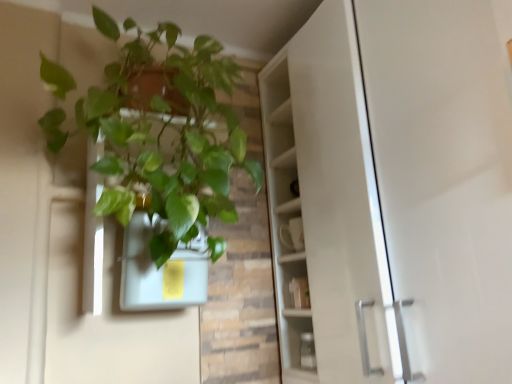
Question: Is matte white flowerpot at upper left surrounded by green matte plant at upper left?

Choices:
 (A) yes
 (B) no

Answer: (A)

Question: Can you confirm if green matte plant at upper left is shorter than matte white flowerpot at upper left?

Choices:
 (A) no
 (B) yes

Answer: (A)

Question: Considering the relative sizes of green matte plant at upper left and matte white flowerpot at upper left in the image provided, is green matte plant at upper left taller than matte white flowerpot at upper left?

Choices:
 (A) yes
 (B) no

Answer: (A)

Question: Can you confirm if green matte plant at upper left is positioned to the right of matte white flowerpot at upper left?

Choices:
 (A) yes
 (B) no

Answer: (B)

Question: From a real-world perspective, is green matte plant at upper left positioned under matte white flowerpot at upper left based on gravity?

Choices:
 (A) no
 (B) yes

Answer: (A)

Question: Does green matte plant at upper left have a smaller size compared to matte white flowerpot at upper left?

Choices:
 (A) no
 (B) yes

Answer: (A)

Question: Would you say green matte plant at upper left is part of matte white flowerpot at upper left's contents?

Choices:
 (A) yes
 (B) no

Answer: (B)

Question: From a real-world perspective, is matte white flowerpot at upper left positioned over green matte plant at upper left based on gravity?

Choices:
 (A) yes
 (B) no

Answer: (B)

Question: Is matte white flowerpot at upper left turned away from green matte plant at upper left?

Choices:
 (A) yes
 (B) no

Answer: (A)

Question: Does matte white flowerpot at upper left appear on the left side of green matte plant at upper left?

Choices:
 (A) yes
 (B) no

Answer: (B)

Question: From the image's perspective, is matte white flowerpot at upper left located above green matte plant at upper left?

Choices:
 (A) yes
 (B) no

Answer: (B)

Question: Considering the relative sizes of matte white flowerpot at upper left and green matte plant at upper left in the image provided, is matte white flowerpot at upper left smaller than green matte plant at upper left?

Choices:
 (A) no
 (B) yes

Answer: (B)

Question: From a real-world perspective, is green matte plant at upper left above or below matte white flowerpot at upper left?

Choices:
 (A) below
 (B) above

Answer: (B)